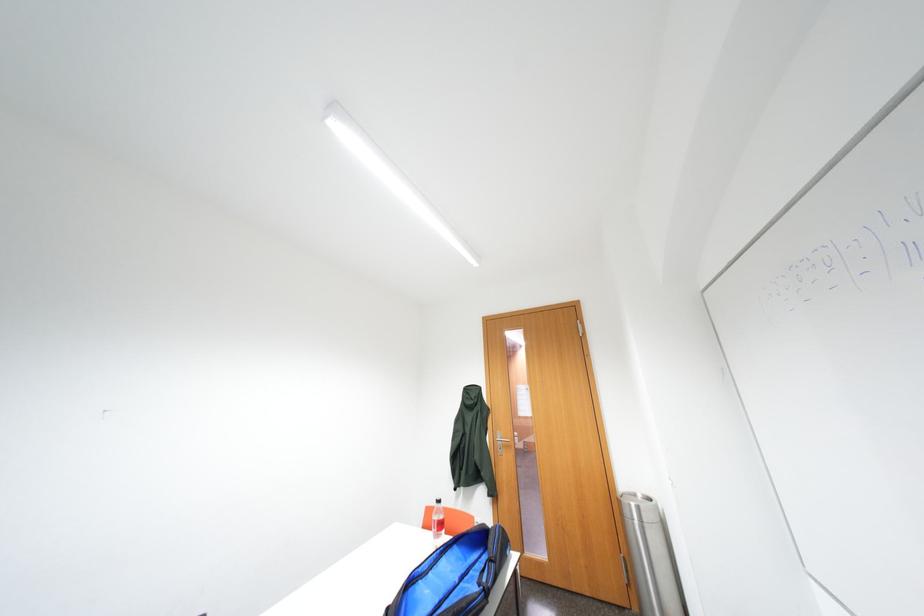
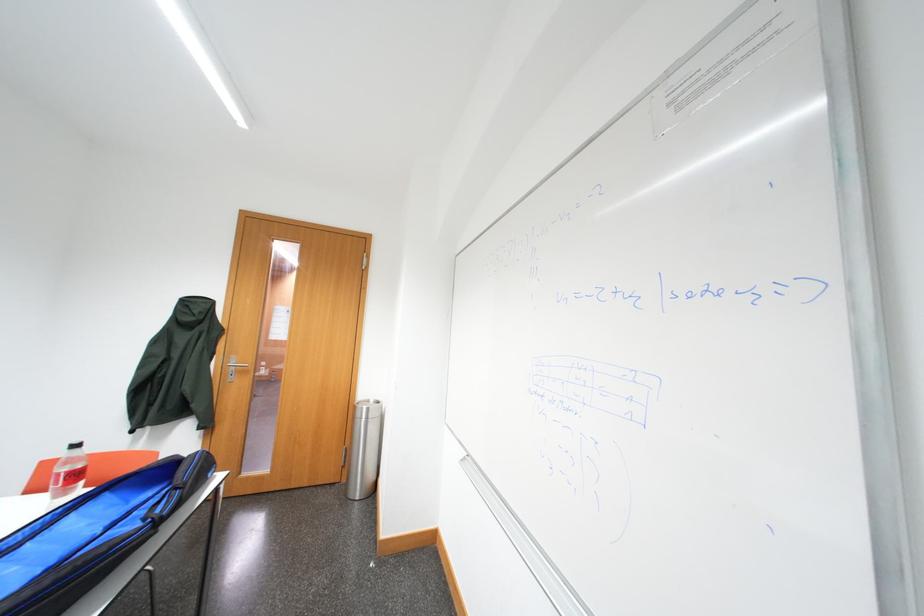
Question: The images are taken continuously from a first-person perspective. In which direction is your viewpoint rotating?

Choices:
 (A) Left
 (B) Right
 (C) Up
 (D) Down

Answer: (B)